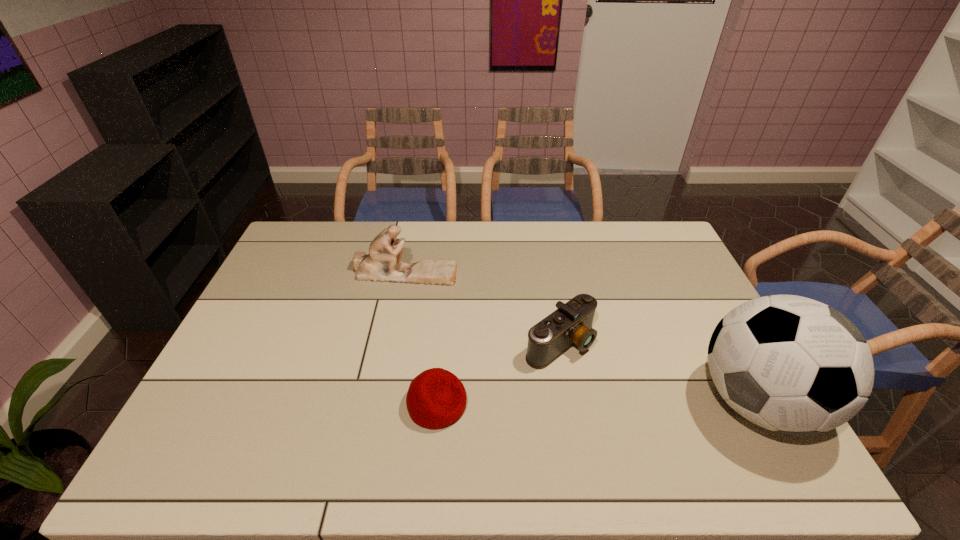
Image resolution: width=960 pixels, height=540 pixels. In order to click on vacant spot on the desktop that is between the shortest object and the soccer ball and is positioned on the front-facing side of the figurine in this screenshot , I will do `click(551, 403)`.

This screenshot has width=960, height=540. Identify the location of free space on the desktop that is between the shortest object and the tallest object and is positioned on the lens of the third object from left to right. (639, 402).